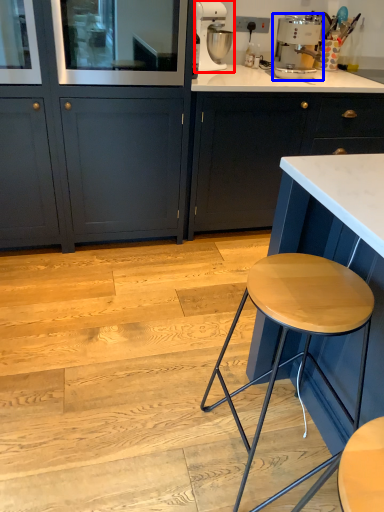
Question: Which of the following is the closest to the observer, kitchen appliance (highlighted by a red box) or home appliance (highlighted by a blue box)?

Choices:
 (A) kitchen appliance
 (B) home appliance

Answer: (B)